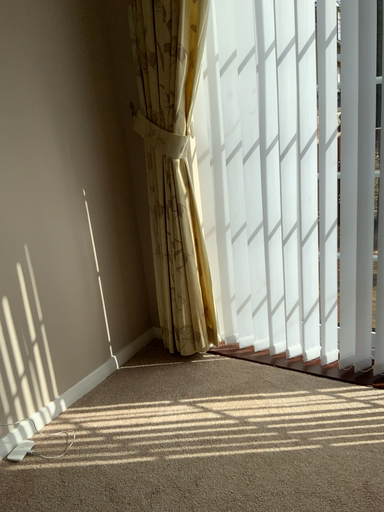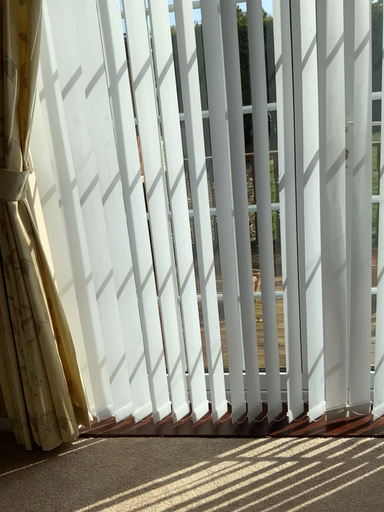
Question: How did the camera likely rotate when shooting the video?

Choices:
 (A) rotated left
 (B) rotated right

Answer: (B)